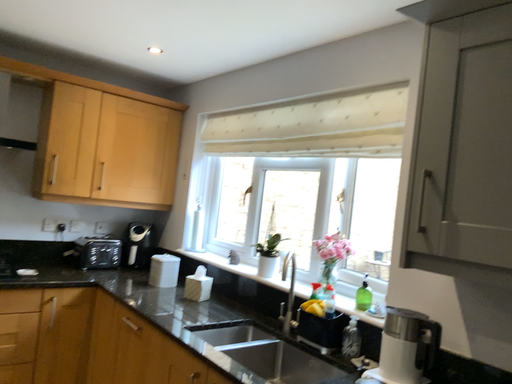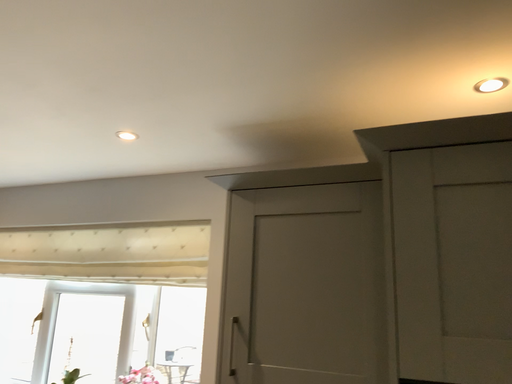
Question: How did the camera likely rotate when shooting the video?

Choices:
 (A) rotated downward
 (B) rotated upward

Answer: (B)